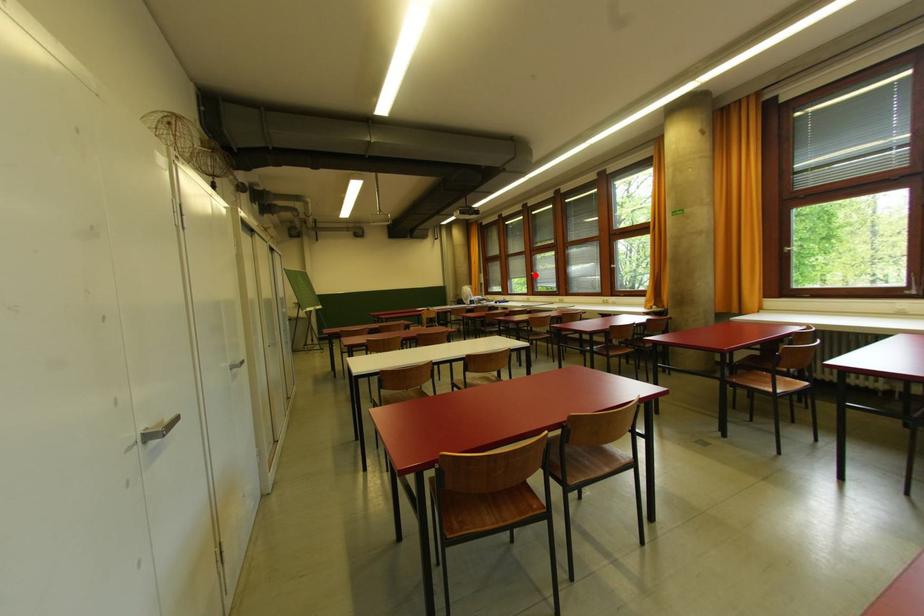
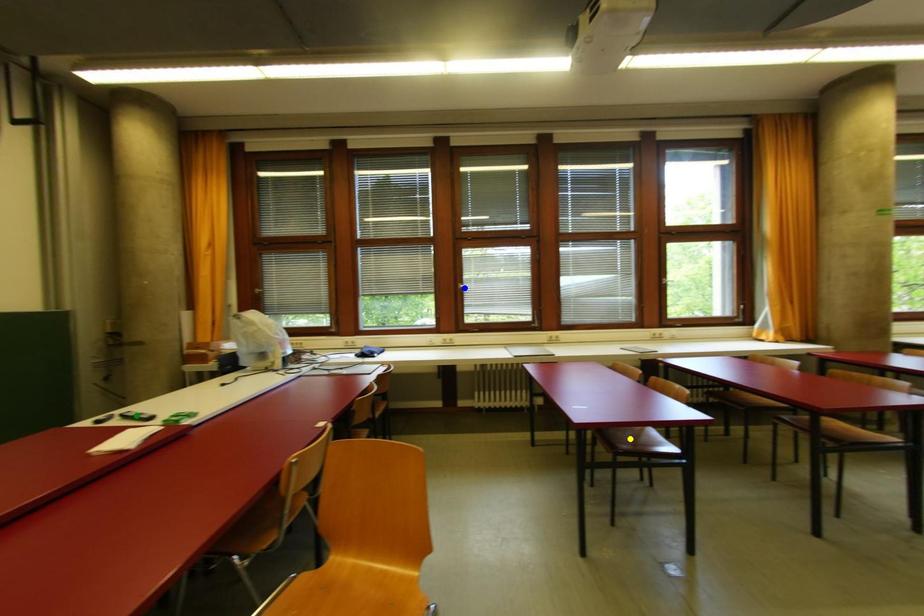
Question: I am providing you with two images of the same scene from different viewpoints. A red point is marked on the first image. You are given multiple points on the second image. In image 2, which mark is for the same physical point as the one in image 1?

Choices:
 (A) yellow point
 (B) blue point
 (C) green point

Answer: (B)